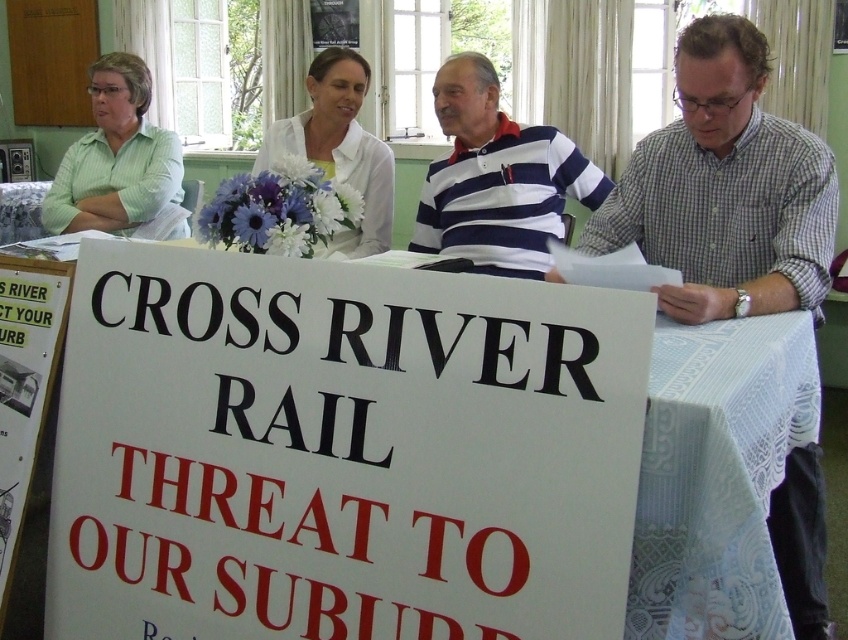
You are attending a community meeting and notice two people at the table. The checkered fabric shirt at right and the white matte shirt at center. Which person is sitting closer to the edge of the table?

The checkered fabric shirt at right is sitting closer to the edge of the table because it is positioned under the white matte shirt at center, indicating it is further out.